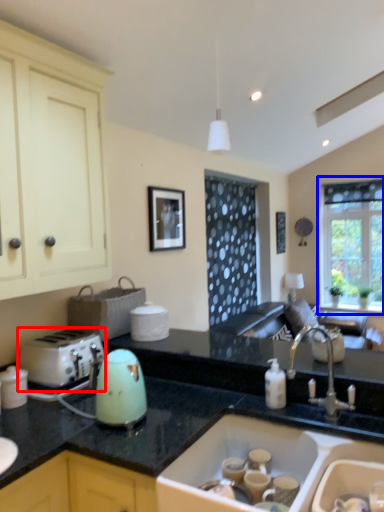
Question: Which object is further to the camera taking this photo, toaster (highlighted by a red box) or window (highlighted by a blue box)?

Choices:
 (A) toaster
 (B) window

Answer: (B)